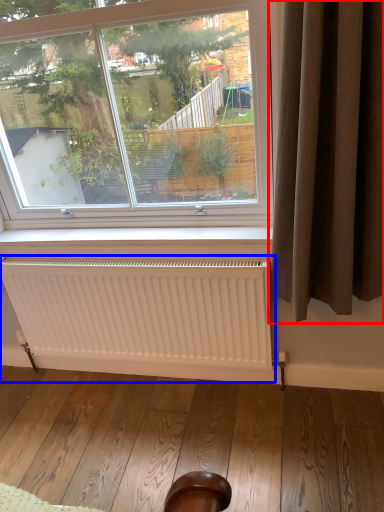
Question: Which of the following is the closest to the observer, curtain (highlighted by a red box) or radiator (highlighted by a blue box)?

Choices:
 (A) curtain
 (B) radiator

Answer: (A)